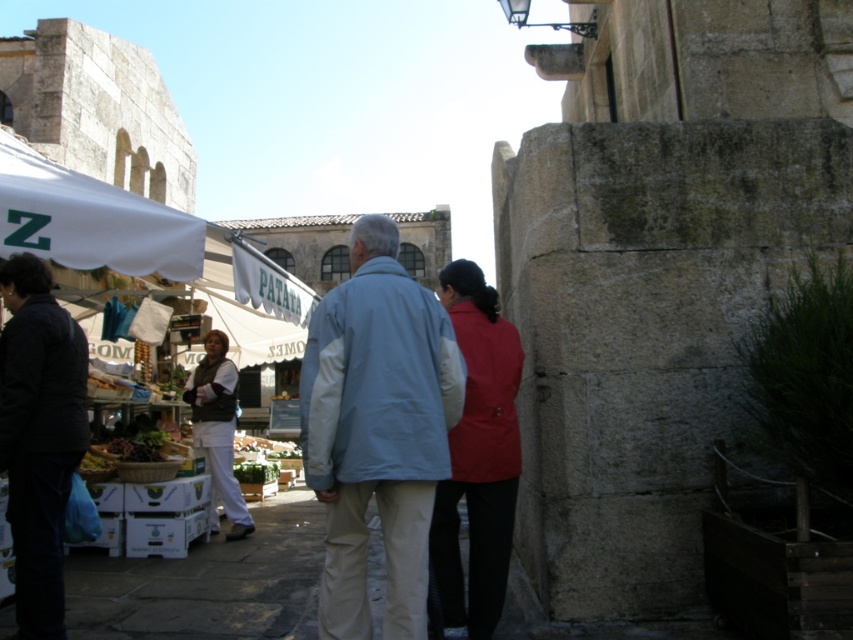
Can you confirm if dark blue fabric jacket at left is wider than matte red jacket at center?

Indeed, dark blue fabric jacket at left has a greater width compared to matte red jacket at center.

Does dark blue fabric jacket at left lie in front of matte red jacket at center?

Yes, dark blue fabric jacket at left is in front of matte red jacket at center.

Image resolution: width=853 pixels, height=640 pixels. What are the coordinates of `dark blue fabric jacket at left` in the screenshot? It's located at (39, 436).

In the scene shown: Between dark blue fabric jacket at left and white cotton pants at lower left, which one has more height?

With more height is dark blue fabric jacket at left.

Is point (70, 384) closer to viewer compared to point (215, 339)?

That is True.

Locate an element on the screen. dark blue fabric jacket at left is located at coordinates (39, 436).

Is point (361, 465) farther from camera compared to point (223, 348)?

That is False.

Which is in front, point (378, 323) or point (202, 372)?

Point (378, 323)

Image resolution: width=853 pixels, height=640 pixels. I want to click on light blue fabric jacket at center, so click(376, 429).